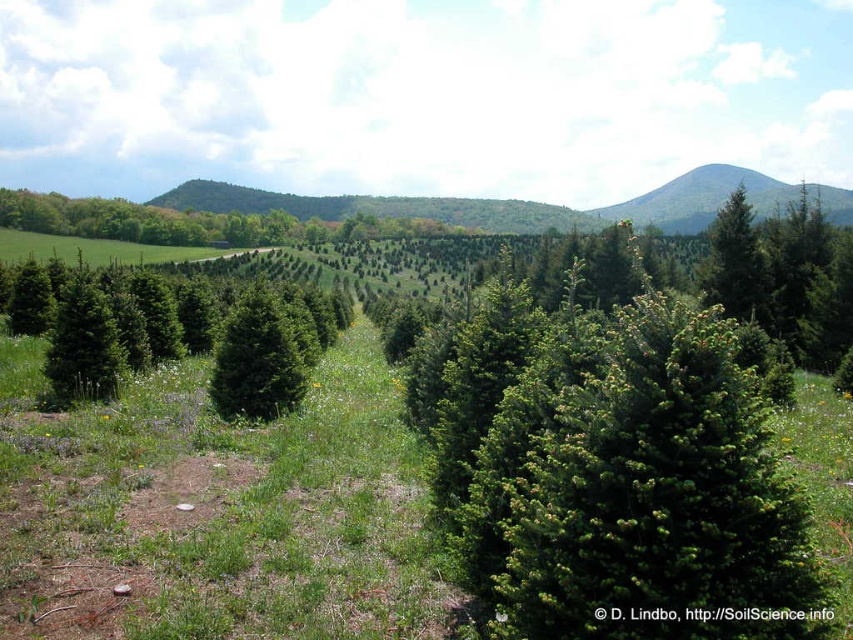
Question: Does green matte evergreen tree at center lie behind green matte evergreen tree at upper right?

Choices:
 (A) yes
 (B) no

Answer: (B)

Question: Which object is positioned farthest from the green matte evergreen tree at center?

Choices:
 (A) green textured hillside at upper right
 (B) green matte evergreen tree at upper right

Answer: (A)

Question: Which point appears closest to the camera in this image?

Choices:
 (A) (737, 214)
 (B) (329, 296)
 (C) (682, 216)

Answer: (A)

Question: Which of these objects is positioned farthest from the green matte evergreen tree at center?

Choices:
 (A) green textured hillside at upper right
 (B) green matte evergreen tree at upper right

Answer: (A)

Question: Does green matte evergreen tree at center have a smaller size compared to green textured hillside at upper right?

Choices:
 (A) yes
 (B) no

Answer: (A)

Question: Is green matte evergreen tree at center to the left of green matte evergreen tree at upper right from the viewer's perspective?

Choices:
 (A) yes
 (B) no

Answer: (A)